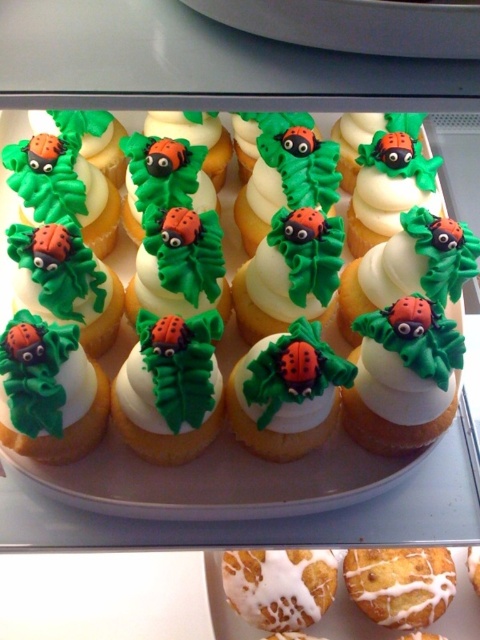
You are a baker who needs to check the decorations on the cupcakes. You see the matte green frosting at center and the iced white bun at center. Which decoration is placed on top of the other?

The matte green frosting at center is positioned over the iced white bun at center, so the matte green frosting at center is on top of the iced white bun at center.

You are a baker trying to place a new cupcake on the tray. You want to put it behind the iced white bun at center so it aligns with the matte green frosting at center. Is this possible?

The matte green frosting at center is closer to the viewer than the iced white bun at center, so placing the new cupcake behind the iced white bun at center would not align it with the matte green frosting at center since the frosting is already in front.

You are a baker trying to decide which item to place in the center of a display. You have a matte green frosting at center and a white glazed donut at center. Based on their thickness, which one would you choose to ensure it stands out more?

The white glazed donut at center is thicker than the matte green frosting at center, so it would stand out more in the display.